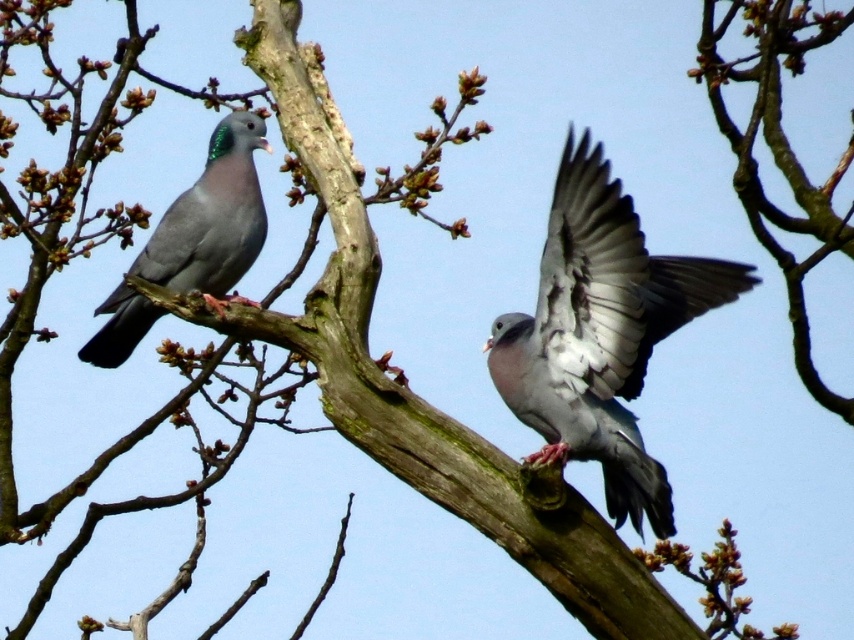
Question: Which point is closer to the camera?

Choices:
 (A) (231, 252)
 (B) (607, 436)

Answer: (B)

Question: Is gray matte pigeon at center bigger than matte gray pigeon at left?

Choices:
 (A) no
 (B) yes

Answer: (B)

Question: Does gray matte pigeon at center have a lesser width compared to matte gray pigeon at left?

Choices:
 (A) no
 (B) yes

Answer: (A)

Question: Can you confirm if gray matte pigeon at center is bigger than matte gray pigeon at left?

Choices:
 (A) yes
 (B) no

Answer: (A)

Question: Which point appears farthest from the camera in this image?

Choices:
 (A) (615, 369)
 (B) (249, 147)

Answer: (B)

Question: Which of the following is the farthest from the observer?

Choices:
 (A) gray matte pigeon at center
 (B) matte gray pigeon at left

Answer: (B)